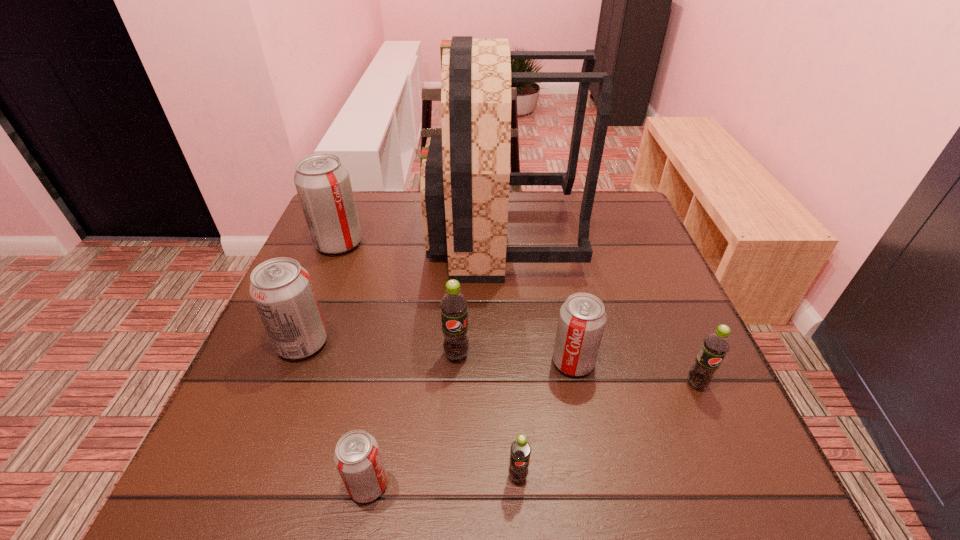
Image resolution: width=960 pixels, height=540 pixels. In the image, there is a desktop. In order to click on vacant space at the far left corner in this screenshot , I will do `click(380, 199)`.

Image resolution: width=960 pixels, height=540 pixels. In order to click on vacant area at the far right corner of the desktop in this screenshot , I will do `click(620, 226)`.

Locate an element on the screen. unoccupied area between the farthest gray soda can and the rightmost object is located at coordinates (517, 314).

You are a GUI agent. You are given a task and a screenshot of the screen. Output one action in this format:
    pyautogui.click(x=<x>, y=<y>)
    Task: Click on the free space that is in between the second green soda from left to right and the farthest green soda
    The width and height of the screenshot is (960, 540).
    Given the screenshot: What is the action you would take?
    pyautogui.click(x=487, y=415)

Find the location of a particular element. The height and width of the screenshot is (540, 960). vacant space that is in between the nearest green soda and the third smallest gray soda can is located at coordinates (410, 410).

Locate an element on the screen. free space that is in between the second biggest green soda and the rightmost gray soda can is located at coordinates (635, 373).

This screenshot has height=540, width=960. Identify the location of free space that is in between the smallest gray soda can and the backpack. (435, 360).

Image resolution: width=960 pixels, height=540 pixels. Find the location of `free spot between the nearest green soda and the third smallest gray soda can`. free spot between the nearest green soda and the third smallest gray soda can is located at coordinates (410, 410).

This screenshot has height=540, width=960. I want to click on vacant space that is in between the second biggest gray soda can and the fifth soda can from left to right, so click(410, 410).

Where is `blank region between the rightmost soda can and the smallest gray soda can`? The height and width of the screenshot is (540, 960). blank region between the rightmost soda can and the smallest gray soda can is located at coordinates (532, 434).